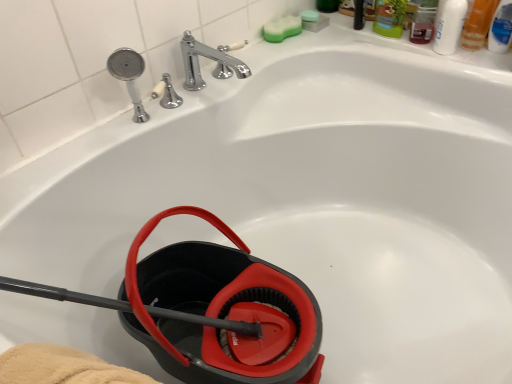
You are a GUI agent. You are given a task and a screenshot of the screen. Output one action in this format:
    pyautogui.click(x=<x>, y=<y>)
    Task: Click on the chrome metallic faucet at upper center
    The width and height of the screenshot is (512, 384).
    Given the screenshot: What is the action you would take?
    pyautogui.click(x=211, y=59)

Measure the distance between green sponge at upper right, which is counted as the 2th soap, starting from the right, and camera.

They are 1.45 meters apart.

Locate an element on the screen. black rubber garden hose at lower left is located at coordinates (211, 310).

Find the location of `white glossy bottle at upper right, the 1th mouthwash viewed from the left`. white glossy bottle at upper right, the 1th mouthwash viewed from the left is located at coordinates (448, 25).

Can you confirm if translucent plastic mouthwash at upper right, the second mouthwash when ordered from left to right, is taller than white glossy bottle at upper right, acting as the third mouthwash starting from the right?

Yes, translucent plastic mouthwash at upper right, the second mouthwash when ordered from left to right, is taller than white glossy bottle at upper right, acting as the third mouthwash starting from the right.

Could you measure the distance between translucent plastic mouthwash at upper right, the second mouthwash when ordered from left to right, and white glossy bottle at upper right, acting as the third mouthwash starting from the right?

translucent plastic mouthwash at upper right, the second mouthwash when ordered from left to right, and white glossy bottle at upper right, acting as the third mouthwash starting from the right, are 3.20 inches apart.

From the image's perspective, starting from the translucent plastic mouthwash at upper right, which is the second mouthwash in right-to-left order, which mouthwash is the 1st one below? Please provide its 2D coordinates.

[(448, 25)]

Does translucent plastic mouthwash at upper right, which is the second mouthwash in right-to-left order, appear on the right side of white glossy bottle at upper right, acting as the third mouthwash starting from the right?

Yes, translucent plastic mouthwash at upper right, which is the second mouthwash in right-to-left order, is to the right of white glossy bottle at upper right, acting as the third mouthwash starting from the right.

Considering the points (312, 10) and (188, 83), which point is in front, point (312, 10) or point (188, 83)?

The point (188, 83) is closer.

From a real-world perspective, is green sponge at upper center, the 2th soap from the left, under chrome metallic faucet at upper center?

Yes, from a real-world perspective, green sponge at upper center, the 2th soap from the left, is below chrome metallic faucet at upper center.

Is green sponge at upper center, the 2th soap from the left, outside of chrome metallic faucet at upper center?

Indeed, green sponge at upper center, the 2th soap from the left, is completely outside chrome metallic faucet at upper center.

Between green sponge at upper center, which ranks as the 1th soap in right-to-left order, and chrome metallic faucet at upper center, which one is positioned behind?

Positioned behind is green sponge at upper center, which ranks as the 1th soap in right-to-left order.

How many degrees apart are the facing directions of white glossy bottle at upper right, acting as the third mouthwash starting from the right, and blue plastic mouthwash at upper right, arranged as the first mouthwash when viewed from the right?

white glossy bottle at upper right, acting as the third mouthwash starting from the right, and blue plastic mouthwash at upper right, arranged as the first mouthwash when viewed from the right, are facing 3.32 degrees away from each other.

Between white glossy bottle at upper right, the 1th mouthwash viewed from the left, and blue plastic mouthwash at upper right, arranged as the first mouthwash when viewed from the right, which one has smaller width?

Thinner between the two is blue plastic mouthwash at upper right, arranged as the first mouthwash when viewed from the right.

From the image's perspective, which one is positioned higher, white glossy bottle at upper right, the 1th mouthwash viewed from the left, or blue plastic mouthwash at upper right, placed as the third mouthwash when sorted from left to right?

white glossy bottle at upper right, the 1th mouthwash viewed from the left, appears higher in the image.

Between white glossy bottle at upper right, the 1th mouthwash viewed from the left, and blue plastic mouthwash at upper right, placed as the third mouthwash when sorted from left to right, which one is positioned behind?

blue plastic mouthwash at upper right, placed as the third mouthwash when sorted from left to right, is behind.

Where is `mouthwash that is the 3rd one when counting rightward from the black rubber garden hose at lower left`? The width and height of the screenshot is (512, 384). mouthwash that is the 3rd one when counting rightward from the black rubber garden hose at lower left is located at coordinates (501, 28).

How much distance is there between black rubber garden hose at lower left and blue plastic mouthwash at upper right, arranged as the first mouthwash when viewed from the right?

A distance of 3.70 feet exists between black rubber garden hose at lower left and blue plastic mouthwash at upper right, arranged as the first mouthwash when viewed from the right.

Is black rubber garden hose at lower left inside the boundaries of blue plastic mouthwash at upper right, placed as the third mouthwash when sorted from left to right, or outside?

A: black rubber garden hose at lower left is outside blue plastic mouthwash at upper right, placed as the third mouthwash when sorted from left to right.

How many degrees apart are the facing directions of black rubber garden hose at lower left and blue plastic mouthwash at upper right, arranged as the first mouthwash when viewed from the right?

The angular difference between black rubber garden hose at lower left and blue plastic mouthwash at upper right, arranged as the first mouthwash when viewed from the right, is 103 degrees.

Between white glossy bottle at upper right, acting as the third mouthwash starting from the right, and black rubber garden hose at lower left, which one appears on the right side from the viewer's perspective?

From the viewer's perspective, white glossy bottle at upper right, acting as the third mouthwash starting from the right, appears more on the right side.

Where is `mouthwash that is the 1st object located behind the black rubber garden hose at lower left`? mouthwash that is the 1st object located behind the black rubber garden hose at lower left is located at coordinates (448, 25).

Which object is thinner, white glossy bottle at upper right, acting as the third mouthwash starting from the right, or black rubber garden hose at lower left?

With smaller width is white glossy bottle at upper right, acting as the third mouthwash starting from the right.

Is white glossy bottle at upper right, acting as the third mouthwash starting from the right, with black rubber garden hose at lower left?

No.

Between white glossy bottle at upper right, acting as the third mouthwash starting from the right, and translucent plastic mouthwash at upper right, the second mouthwash when ordered from left to right, which one has larger size?

With larger size is translucent plastic mouthwash at upper right, the second mouthwash when ordered from left to right.

Which object is wider, white glossy bottle at upper right, acting as the third mouthwash starting from the right, or translucent plastic mouthwash at upper right, the second mouthwash when ordered from left to right?

translucent plastic mouthwash at upper right, the second mouthwash when ordered from left to right.

Is white glossy bottle at upper right, the 1th mouthwash viewed from the left, not close to translucent plastic mouthwash at upper right, which is the second mouthwash in right-to-left order?

No, white glossy bottle at upper right, the 1th mouthwash viewed from the left, is in close proximity to translucent plastic mouthwash at upper right, which is the second mouthwash in right-to-left order.

Which is in front, point (453, 8) or point (479, 7)?

Positioned in front is point (453, 8).

Are white glossy bottle at upper right, acting as the third mouthwash starting from the right, and chrome metallic faucet at upper center far apart?

That's not correct — white glossy bottle at upper right, acting as the third mouthwash starting from the right, is a little close to chrome metallic faucet at upper center.

Who is more distant, white glossy bottle at upper right, acting as the third mouthwash starting from the right, or chrome metallic faucet at upper center?

white glossy bottle at upper right, acting as the third mouthwash starting from the right, is more distant.

Which is less distant, [448,36] or [192,88]?

Point [448,36] appears to be farther away from the viewer than point [192,88].

Where is `mouthwash above the translucent plastic mouthwash at upper right, the second mouthwash when ordered from left to right (from a real-world perspective)`? mouthwash above the translucent plastic mouthwash at upper right, the second mouthwash when ordered from left to right (from a real-world perspective) is located at coordinates (448, 25).

Where is `the 2nd soap above when counting from the chrome metallic faucet at upper center (from the image's perspective)`? The image size is (512, 384). the 2nd soap above when counting from the chrome metallic faucet at upper center (from the image's perspective) is located at coordinates (310, 16).

Looking at this image, looking at the image, which one is located further to blue plastic mouthwash at upper right, placed as the third mouthwash when sorted from left to right, black rubber garden hose at lower left or chrome metallic faucet at upper center?

black rubber garden hose at lower left.

From the image, which object appears to be farther from white glossy bottle at upper right, acting as the third mouthwash starting from the right, chrome metallic faucet at upper center or translucent plastic mouthwash at upper right, which is the second mouthwash in right-to-left order?

chrome metallic faucet at upper center is positioned further to the anchor white glossy bottle at upper right, acting as the third mouthwash starting from the right.

Looking at this image, from the image, which object appears to be farther from white glossy bottle at upper right, acting as the third mouthwash starting from the right, green sponge at upper right, which is counted as the 2th soap, starting from the right, or black rubber garden hose at lower left?

black rubber garden hose at lower left.

Based on their spatial positions, is black rubber garden hose at lower left or green sponge at upper center, which ranks as the 1th soap in right-to-left order, further from translucent plastic mouthwash at upper right, the second mouthwash when ordered from left to right?

black rubber garden hose at lower left is positioned further to the anchor translucent plastic mouthwash at upper right, the second mouthwash when ordered from left to right.

When comparing their distances from white glossy bottle at upper right, the 1th mouthwash viewed from the left, does blue plastic mouthwash at upper right, placed as the third mouthwash when sorted from left to right, or chrome metallic faucet at upper center seem further?

chrome metallic faucet at upper center.

Estimate the real-world distances between objects in this image. Which object is further from chrome metallic faucet at upper center, translucent plastic mouthwash at upper right, the second mouthwash when ordered from left to right, or green sponge at upper right, positioned as the 1th soap in left-to-right order?

The object further to chrome metallic faucet at upper center is translucent plastic mouthwash at upper right, the second mouthwash when ordered from left to right.

From the picture: Which object lies further to the anchor point chrome metallic faucet at upper center, green sponge at upper center, which ranks as the 1th soap in right-to-left order, or blue plastic mouthwash at upper right, arranged as the first mouthwash when viewed from the right?

The object further to chrome metallic faucet at upper center is blue plastic mouthwash at upper right, arranged as the first mouthwash when viewed from the right.

Based on their spatial positions, is green sponge at upper center, which ranks as the 1th soap in right-to-left order, or green sponge at upper right, positioned as the 1th soap in left-to-right order, further from translucent plastic mouthwash at upper right, which is the second mouthwash in right-to-left order?

Based on the image, green sponge at upper right, positioned as the 1th soap in left-to-right order, appears to be further to translucent plastic mouthwash at upper right, which is the second mouthwash in right-to-left order.

You are a GUI agent. You are given a task and a screenshot of the screen. Output one action in this format:
    pyautogui.click(x=<x>, y=<y>)
    Task: Click on the tap between white glossy bottle at upper right, the 1th mouthwash viewed from the left, and black rubber garden hose at lower left vertically
    Image resolution: width=512 pixels, height=384 pixels.
    Given the screenshot: What is the action you would take?
    pyautogui.click(x=211, y=59)

The height and width of the screenshot is (384, 512). Find the location of `mouthwash between chrome metallic faucet at upper center and translucent plastic mouthwash at upper right, the second mouthwash when ordered from left to right, from left to right`. mouthwash between chrome metallic faucet at upper center and translucent plastic mouthwash at upper right, the second mouthwash when ordered from left to right, from left to right is located at coordinates (448, 25).

Identify the location of tap between green sponge at upper right, positioned as the 1th soap in left-to-right order, and black rubber garden hose at lower left in the up-down direction. Image resolution: width=512 pixels, height=384 pixels. (211, 59).

The image size is (512, 384). I want to click on garden hose between chrome metallic faucet at upper center and translucent plastic mouthwash at upper right, the second mouthwash when ordered from left to right, so click(211, 310).